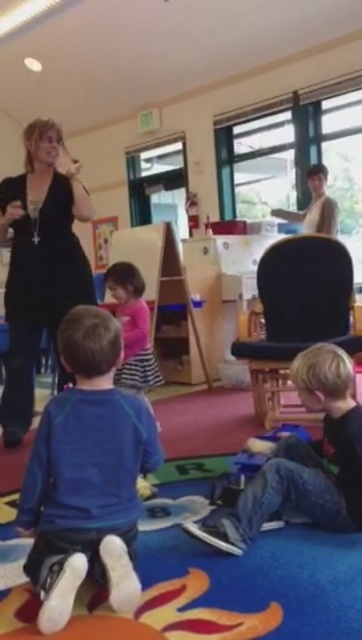
Question: Among these objects, which one is farthest from the camera?

Choices:
 (A) pink striped dress at center
 (B) blue fleece jacket at lower left

Answer: (A)

Question: Based on their relative distances, which object is farther from the blue fleece jacket at lower left?

Choices:
 (A) black matte dress at left
 (B) pink striped dress at center
 (C) matte beige sweater at upper right
 (D) jeans at lower right

Answer: (C)

Question: Can you confirm if black fabric chair at center is bigger than pink striped dress at center?

Choices:
 (A) no
 (B) yes

Answer: (B)

Question: Is blue fleece jacket at lower left thinner than black fabric chair at center?

Choices:
 (A) no
 (B) yes

Answer: (B)

Question: Does black matte dress at left have a lesser width compared to pink striped dress at center?

Choices:
 (A) yes
 (B) no

Answer: (B)

Question: Which point appears farthest from the camera in this image?

Choices:
 (A) (335, 221)
 (B) (139, 280)
 (C) (283, 477)

Answer: (A)